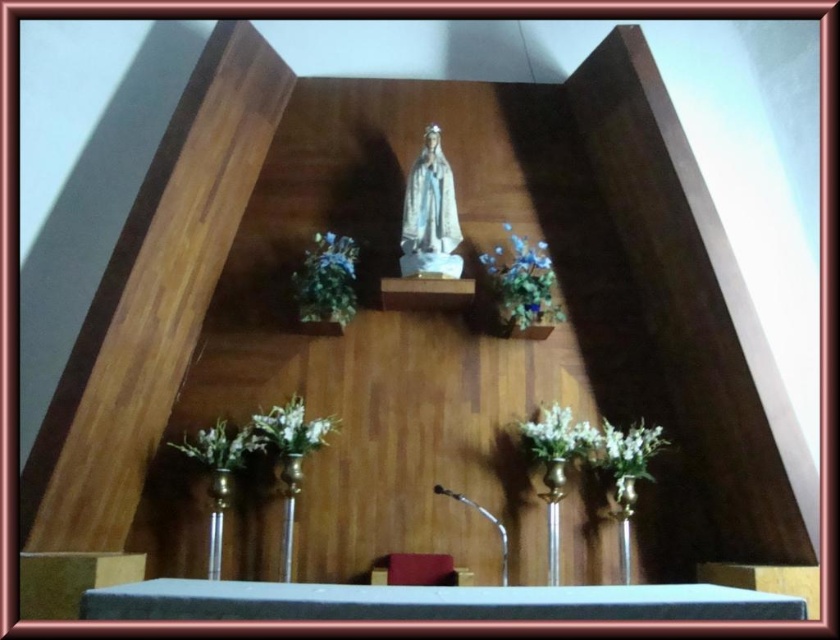
In the scene shown: You are standing in the church and see the white floral arrangement at lower right and the white matte flower at lower right. Which one is positioned to the left of the other?

The white floral arrangement at lower right is positioned to the left of the white matte flower at lower right.